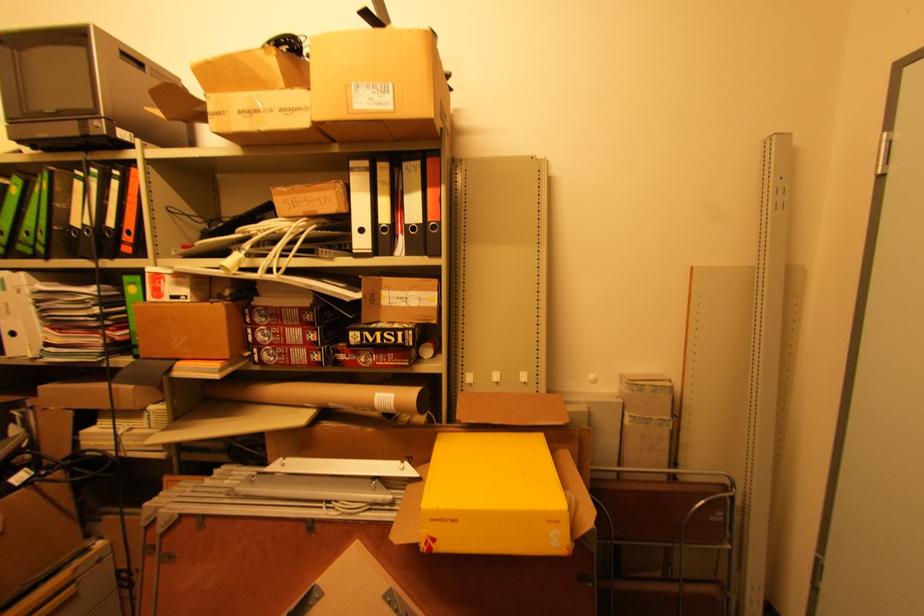
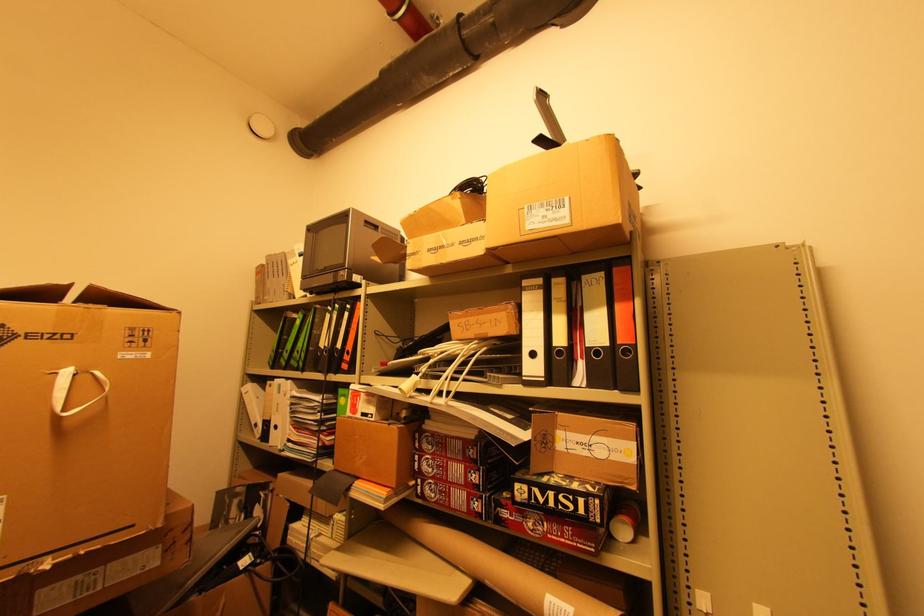
Where in the second image is the point corresponding to (x=419, y=357) from the first image?

(611, 535)